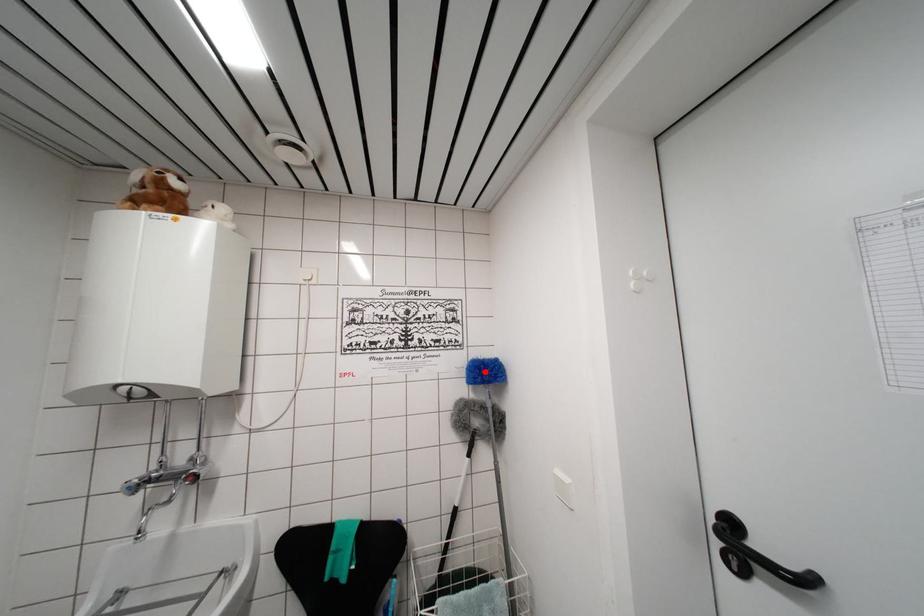
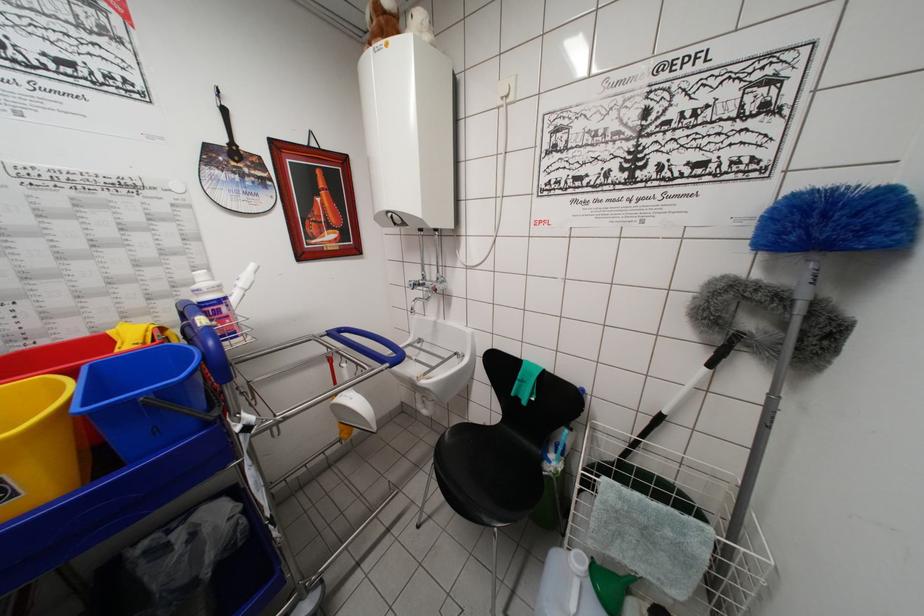
The point at the highlighted location is marked in the first image. Where is the corresponding point in the second image?

(821, 209)